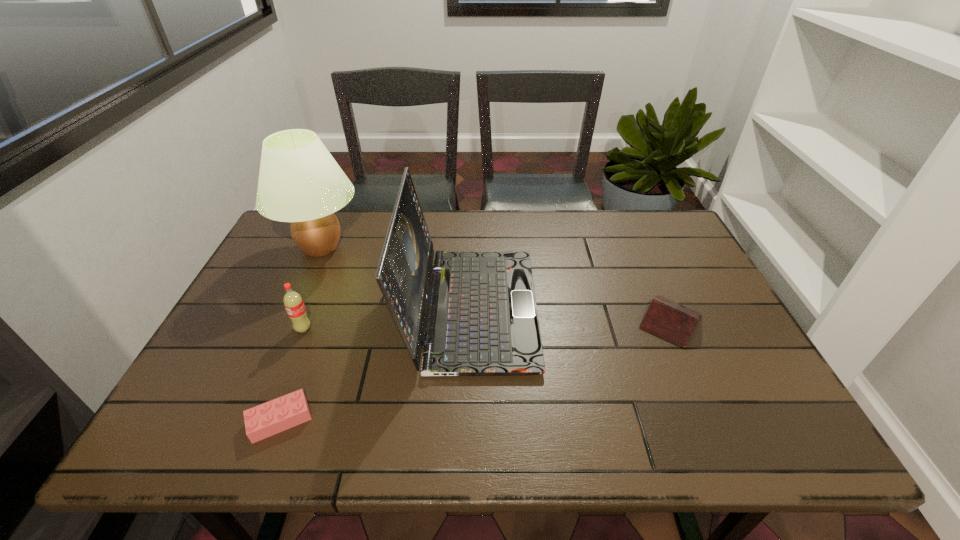
This screenshot has height=540, width=960. What are the coordinates of `lampshade` in the screenshot? It's located at (300, 182).

Image resolution: width=960 pixels, height=540 pixels. Find the location of `the fourth object from left to right`. the fourth object from left to right is located at coordinates (482, 320).

I want to click on the second tallest object, so click(x=482, y=320).

Find the location of `soda`. soda is located at coordinates (293, 302).

Locate an element on the screen. The height and width of the screenshot is (540, 960). the rightmost object is located at coordinates (667, 319).

Find the location of `book`. book is located at coordinates (x=667, y=319).

You are a GUI agent. You are given a task and a screenshot of the screen. Output one action in this format:
    pyautogui.click(x=<x>, y=<y>)
    Task: Click on the shortest object
    
    Given the screenshot: What is the action you would take?
    pyautogui.click(x=262, y=421)

Where is `Lego`? The height and width of the screenshot is (540, 960). Lego is located at coordinates (262, 421).

This screenshot has height=540, width=960. What are the coordinates of `vacant point located 0.210m on the shade of the lampshade` in the screenshot? It's located at (x=432, y=247).

You are a GUI agent. You are given a task and a screenshot of the screen. Output one action in this format:
    pyautogui.click(x=<x>, y=<y>)
    Task: Click on the free region located on the screen of the second object from right to left
    
    Given the screenshot: What is the action you would take?
    pyautogui.click(x=615, y=309)